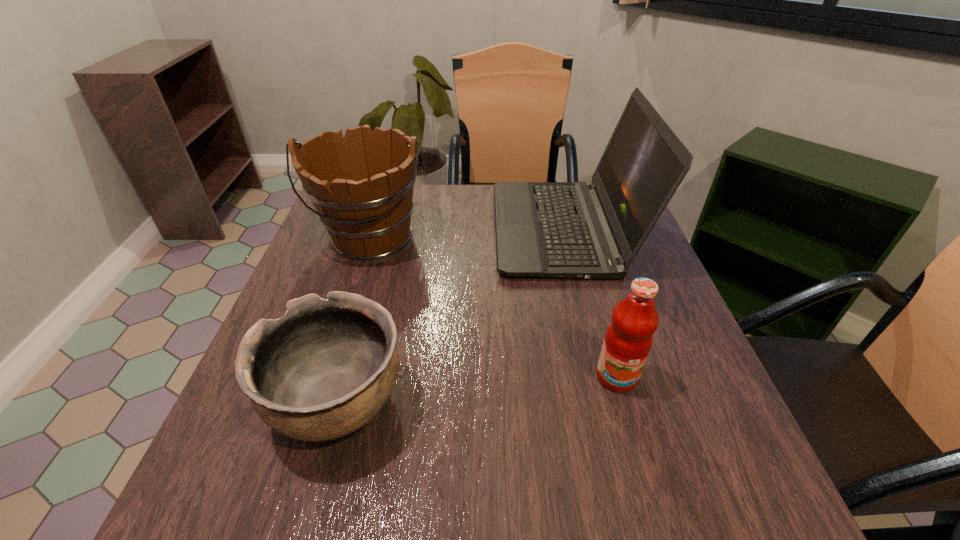
Locate an element on the screen. The height and width of the screenshot is (540, 960). vacant region at the far edge of the desktop is located at coordinates (486, 190).

In the image, there is a desktop. Where is `free region at the left edge`? free region at the left edge is located at coordinates (271, 446).

Locate an element on the screen. vacant space at the right edge is located at coordinates (673, 355).

I want to click on free space at the near left corner of the desktop, so click(x=246, y=467).

This screenshot has width=960, height=540. Identify the location of free spot between the fruit juice and the pottery. (477, 389).

Identify the location of free spot between the pottery and the second shortest object. Image resolution: width=960 pixels, height=540 pixels. (477, 389).

In order to click on free space between the fruit juice and the laptop_computer in this screenshot , I will do `click(589, 303)`.

The image size is (960, 540). I want to click on vacant area that lies between the shortest object and the laptop_computer, so click(x=451, y=316).

The height and width of the screenshot is (540, 960). In order to click on vacant area that lies between the laptop_computer and the wine bucket in this screenshot , I will do `click(468, 233)`.

Find the location of a particular element. free space that is in between the wine bucket and the fruit juice is located at coordinates (493, 307).